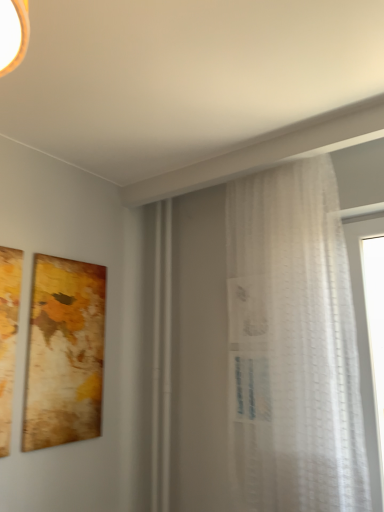
Where is `white sheer curtain at right`? The width and height of the screenshot is (384, 512). white sheer curtain at right is located at coordinates pos(293,345).

This screenshot has width=384, height=512. What do you see at coordinates (293, 345) in the screenshot? I see `white sheer curtain at right` at bounding box center [293, 345].

Image resolution: width=384 pixels, height=512 pixels. What are the coordinates of `matte gold picture frame at left` in the screenshot? It's located at (64, 353).

The width and height of the screenshot is (384, 512). What do you see at coordinates (64, 353) in the screenshot? I see `matte gold picture frame at left` at bounding box center [64, 353].

In order to face matte gold picture frame at left, should I rotate leftwards or rightwards?

You should rotate left by 15.517 degrees.

Locate an element on the screen. white sheer curtain at right is located at coordinates (293, 345).

Between white sheer curtain at right and matte gold picture frame at left, which one appears on the left side from the viewer's perspective?

matte gold picture frame at left is more to the left.

Between white sheer curtain at right and matte gold picture frame at left, which one is positioned behind?

matte gold picture frame at left is behind.

Does point (280, 313) appear closer or farther from the camera than point (54, 269)?

Point (280, 313) appears to be closer to the viewer than point (54, 269).

From the image's perspective, which is above, white sheer curtain at right or matte gold picture frame at left?

white sheer curtain at right appears higher in the image.

From a real-world perspective, which object rests below the other?

matte gold picture frame at left, from a real-world perspective.

Between white sheer curtain at right and matte gold picture frame at left, which one has smaller width?

matte gold picture frame at left.

Which of these two, white sheer curtain at right or matte gold picture frame at left, stands shorter?

→ With less height is matte gold picture frame at left.

Considering the relative sizes of white sheer curtain at right and matte gold picture frame at left in the image provided, is white sheer curtain at right smaller than matte gold picture frame at left?

No, white sheer curtain at right is not smaller than matte gold picture frame at left.

Do you think white sheer curtain at right is within matte gold picture frame at left, or outside of it?

white sheer curtain at right lies outside matte gold picture frame at left.

Looking at this image, can you see white sheer curtain at right touching matte gold picture frame at left?

No.

Looking at this image, is white sheer curtain at right oriented towards matte gold picture frame at left?

No, white sheer curtain at right is not aimed at matte gold picture frame at left.

Measure the distance from white sheer curtain at right to matte gold picture frame at left.

white sheer curtain at right and matte gold picture frame at left are 33.04 inches apart from each other.

There is a matte gold picture frame at left. Where is `curtain above it (from a real-world perspective)`? The image size is (384, 512). curtain above it (from a real-world perspective) is located at coordinates (293, 345).

Considering the relative positions of matte gold picture frame at left and white sheer curtain at right in the image provided, is matte gold picture frame at left to the left or to the right of white sheer curtain at right?

Based on their positions, matte gold picture frame at left is located to the left of white sheer curtain at right.

Consider the image. Which object is more forward, matte gold picture frame at left or white sheer curtain at right?

white sheer curtain at right is more forward.

Considering the points (35, 266) and (307, 456), which point is behind, point (35, 266) or point (307, 456)?

The point (35, 266) is farther from the camera.

From the image's perspective, is matte gold picture frame at left positioned above or below white sheer curtain at right?

matte gold picture frame at left is below white sheer curtain at right.

From a real-world perspective, between matte gold picture frame at left and white sheer curtain at right, who is vertically higher?

white sheer curtain at right.

Considering the sizes of objects matte gold picture frame at left and white sheer curtain at right in the image provided, who is wider, matte gold picture frame at left or white sheer curtain at right?

white sheer curtain at right is wider.

Considering the relative sizes of matte gold picture frame at left and white sheer curtain at right in the image provided, is matte gold picture frame at left taller than white sheer curtain at right?

In fact, matte gold picture frame at left may be shorter than white sheer curtain at right.

Considering the relative sizes of matte gold picture frame at left and white sheer curtain at right in the image provided, is matte gold picture frame at left bigger than white sheer curtain at right?

No, matte gold picture frame at left is not bigger than white sheer curtain at right.

Is matte gold picture frame at left situated inside white sheer curtain at right or outside?

matte gold picture frame at left cannot be found inside white sheer curtain at right.

Is matte gold picture frame at left not near white sheer curtain at right?

No.

Looking at this image, could you tell me if matte gold picture frame at left is facing white sheer curtain at right?

Yes, matte gold picture frame at left is oriented towards white sheer curtain at right.

Measure the distance from matte gold picture frame at left to white sheer curtain at right.

They are 83.92 centimeters apart.

At what (x,y) coordinates should I click in order to perform the action: click on curtain above the matte gold picture frame at left (from the image's perspective). Please return your answer as a coordinate pair (x, y). This screenshot has width=384, height=512. Looking at the image, I should click on (293, 345).

The width and height of the screenshot is (384, 512). Find the location of `picture frame behind the white sheer curtain at right`. picture frame behind the white sheer curtain at right is located at coordinates (64, 353).

Image resolution: width=384 pixels, height=512 pixels. Find the location of `curtain above the matte gold picture frame at left (from the image's perspective)`. curtain above the matte gold picture frame at left (from the image's perspective) is located at coordinates (293, 345).